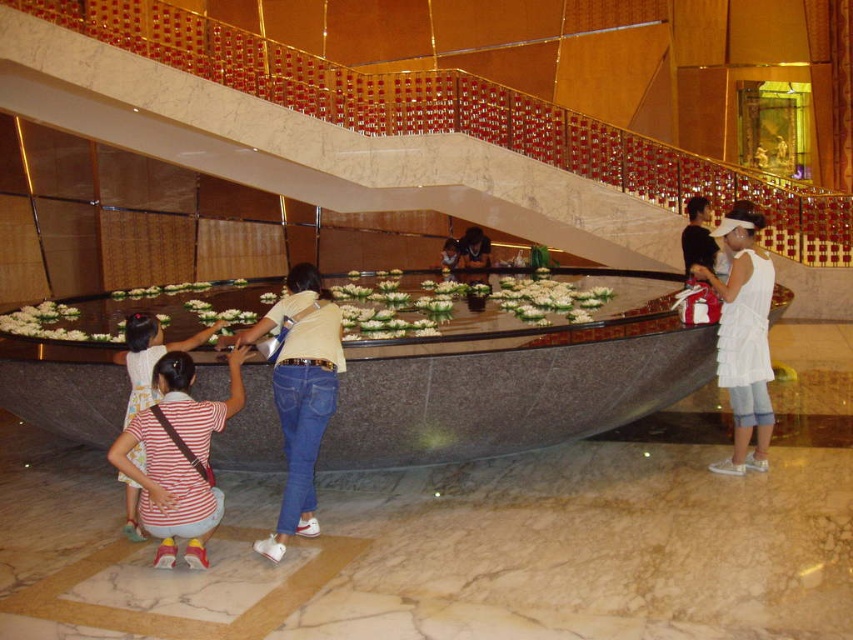
Question: Which of these objects is positioned farthest from the striped fabric shirt at lower left?

Choices:
 (A) jeans at center
 (B) white cotton dress at right

Answer: (B)

Question: Does white cotton dress at right appear on the right side of striped fabric shirt at lower left?

Choices:
 (A) yes
 (B) no

Answer: (A)

Question: Is jeans at center smaller than white cotton dress at right?

Choices:
 (A) no
 (B) yes

Answer: (A)

Question: Can you confirm if jeans at center is positioned above white cotton dress at right?

Choices:
 (A) no
 (B) yes

Answer: (A)

Question: Among these objects, which one is nearest to the camera?

Choices:
 (A) jeans at center
 (B) white cotton dress at right
 (C) striped fabric shirt at lower left

Answer: (A)

Question: Which object is closer to the camera taking this photo?

Choices:
 (A) jeans at center
 (B) striped fabric shirt at lower left

Answer: (A)